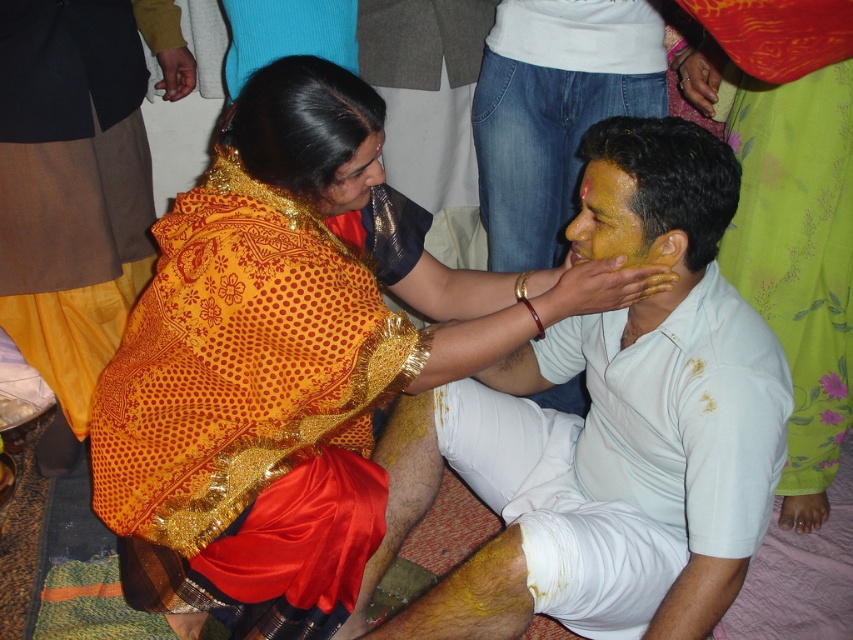
In the scene described, there is a woman applying a yellow substance onto a man wearing a white cotton shirt at center and a yellow matte face at center. Considering the sizes of these two items, which one would require more space to store separately?

The white cotton shirt at center has a larger size compared to yellow matte face at center, so it would require more space to store separately.

You are standing in the scene and want to move from point A to point B. If point A is at coordinates point (x=781, y=400) and point B is at coordinates point (x=627, y=218), will you have to walk behind the woman applying the turmeric paste?

Yes, you will have to walk behind the woman applying the turmeric paste because point (x=781, y=400) is behind point (x=627, y=218).

In the scene shown: In the scene, you see a woman applying a yellow substance to a man. The objects in focus are the white cotton shirt at center and the yellow matte face at center. Which object is positioned lower in the image?

The white cotton shirt at center is located below the yellow matte face at center, so it is positioned lower in the image.